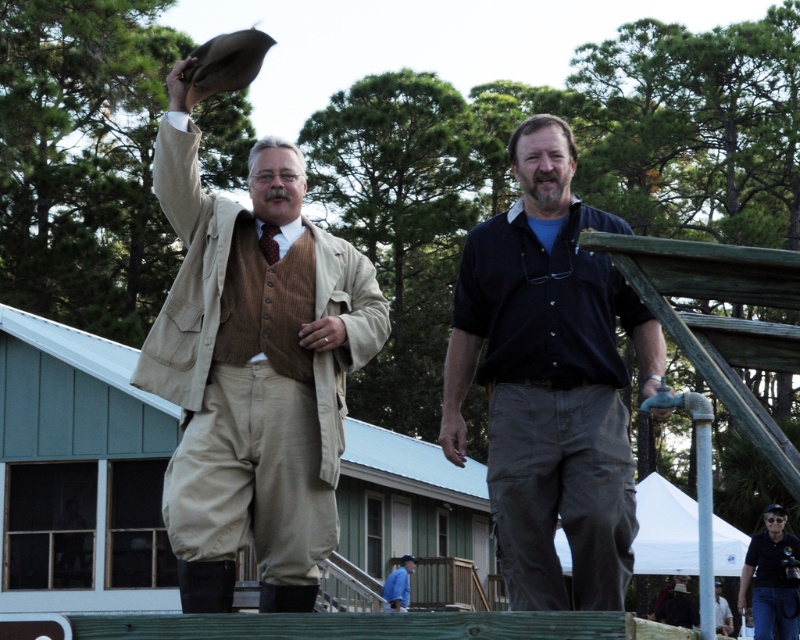
Does dark blue polo shirt at lower right have a lesser width compared to blue denim shirt at lower center?

No.

Does dark blue polo shirt at lower right appear on the right side of blue denim shirt at lower center?

Correct, you'll find dark blue polo shirt at lower right to the right of blue denim shirt at lower center.

Based on the photo, who is more forward, [778,540] or [406,600]?

Point [778,540] is more forward.

Where is `dark blue polo shirt at lower right`? Image resolution: width=800 pixels, height=640 pixels. dark blue polo shirt at lower right is located at coordinates (772, 579).

Can you confirm if beige wool suit at center is smaller than dark blue shirt at center?

Indeed, beige wool suit at center has a smaller size compared to dark blue shirt at center.

Is point (372, 278) farther from camera compared to point (494, 369)?

Yes.

Identify the location of beige wool suit at center. (254, 371).

Does beige wool suit at center have a lesser height compared to light blue shirt at center?

Yes.

Can you confirm if beige wool suit at center is positioned to the left of light blue shirt at center?

Indeed, beige wool suit at center is positioned on the left side of light blue shirt at center.

This screenshot has width=800, height=640. In order to click on beige wool suit at center in this screenshot , I will do click(x=254, y=371).

Where is `beige wool suit at center`? The height and width of the screenshot is (640, 800). beige wool suit at center is located at coordinates pyautogui.click(x=254, y=371).